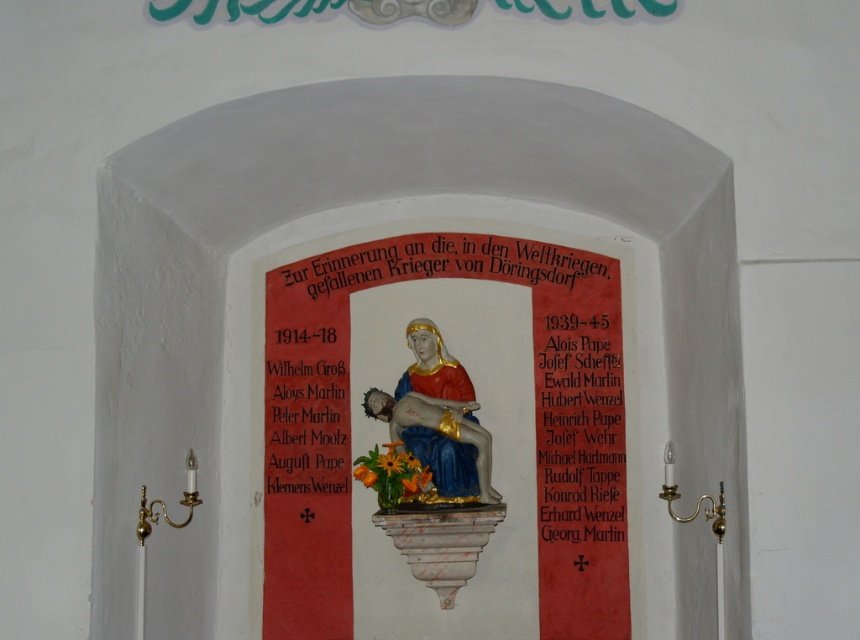
Is matte gold text at left behind polychrome ceramic statue at center?

That is True.

Can you confirm if matte gold text at left is wider than polychrome ceramic statue at center?

In fact, matte gold text at left might be narrower than polychrome ceramic statue at center.

The height and width of the screenshot is (640, 860). In order to click on matte gold text at left in this screenshot , I will do `click(306, 410)`.

This screenshot has height=640, width=860. I want to click on matte gold text at left, so click(x=306, y=410).

Is gold metallic plaque at center to the right of matte gold text at left from the viewer's perspective?

Correct, you'll find gold metallic plaque at center to the right of matte gold text at left.

Locate an element on the screen. gold metallic plaque at center is located at coordinates (441, 268).

Who is lower down, black paper at right or matte gold text at left?

black paper at right is lower down.

Can you confirm if black paper at right is taller than matte gold text at left?

Yes.

Between point (568, 474) and point (289, 428), which one is positioned behind?

Positioned behind is point (289, 428).

Locate an element on the screen. Image resolution: width=860 pixels, height=640 pixels. black paper at right is located at coordinates (579, 428).